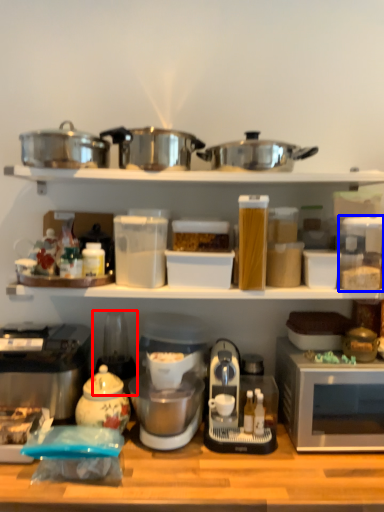
Question: Among these objects, which one is nearest to the camera, appliance (highlighted by a red box) or appliance (highlighted by a blue box)?

Choices:
 (A) appliance
 (B) appliance

Answer: (B)